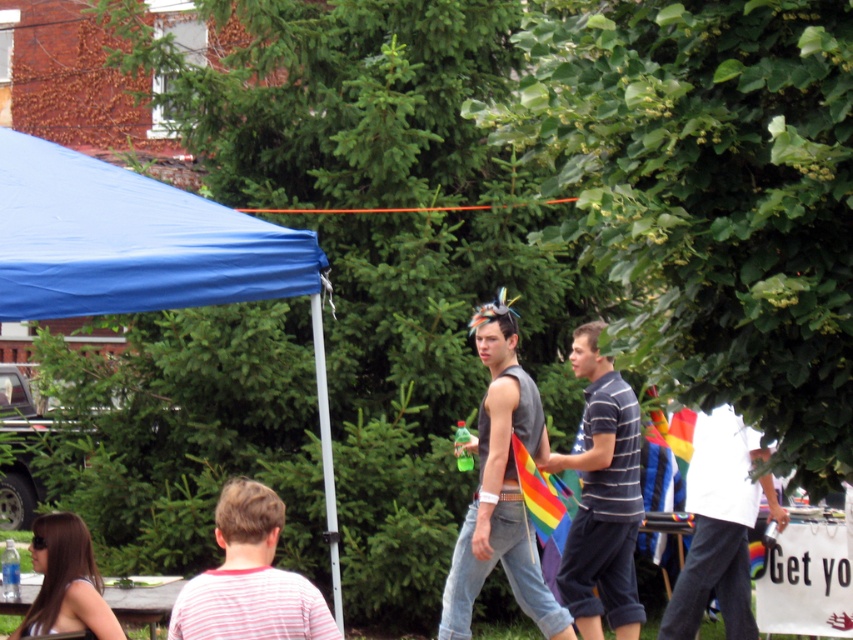
From the picture: Can you confirm if white cotton shirt at right is taller than wooden picnic table at lower left?

Correct, white cotton shirt at right is much taller as wooden picnic table at lower left.

Who is lower down, white cotton shirt at right or wooden picnic table at lower left?

wooden picnic table at lower left is below.

Where is `white cotton shirt at right`? white cotton shirt at right is located at coordinates (720, 525).

Does gray sleeveless shirt at center have a larger size compared to striped cotton shirt at center?

Correct, gray sleeveless shirt at center is larger in size than striped cotton shirt at center.

Which is more to the left, gray sleeveless shirt at center or striped cotton shirt at center?

gray sleeveless shirt at center

Where is `gray sleeveless shirt at center`? This screenshot has height=640, width=853. gray sleeveless shirt at center is located at coordinates (502, 486).

Is striped cotton shirt at center thinner than pink striped shirt at lower left?

Yes, striped cotton shirt at center is thinner than pink striped shirt at lower left.

Does striped cotton shirt at center appear over pink striped shirt at lower left?

Indeed, striped cotton shirt at center is positioned over pink striped shirt at lower left.

This screenshot has width=853, height=640. I want to click on striped cotton shirt at center, so click(x=602, y=497).